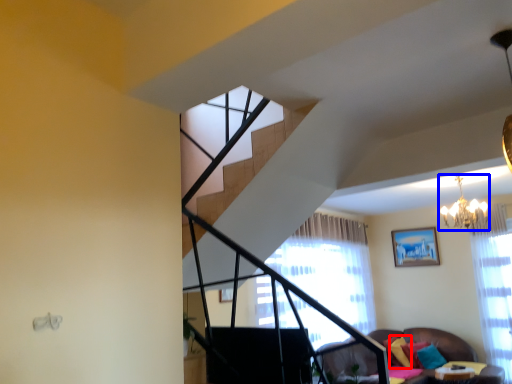
Question: Which object appears closest to the camera in this image, pillow (highlighted by a red box) or light fixture (highlighted by a blue box)?

Choices:
 (A) pillow
 (B) light fixture

Answer: (B)